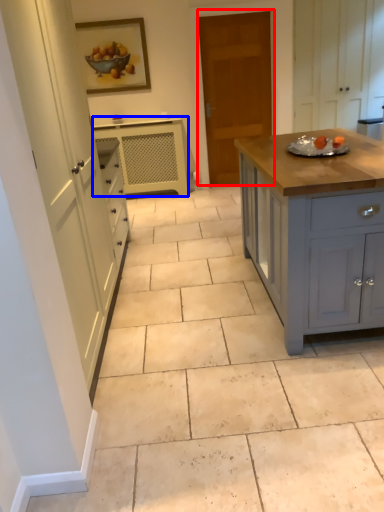
Question: Which point is further to the camera, door (highlighted by a red box) or cabinetry (highlighted by a blue box)?

Choices:
 (A) door
 (B) cabinetry

Answer: (B)